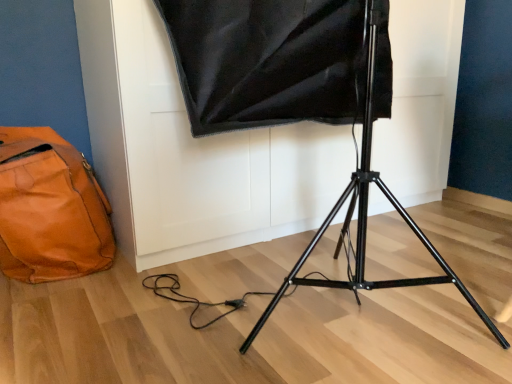
Question: In the image, is orange leather bag at lower left on the left side or the right side of black matte tripod at center?

Choices:
 (A) left
 (B) right

Answer: (A)

Question: Considering the positions of point (84, 218) and point (379, 16), is point (84, 218) closer or farther from the camera than point (379, 16)?

Choices:
 (A) farther
 (B) closer

Answer: (A)

Question: From a real-world perspective, is orange leather bag at lower left positioned above or below black matte tripod at center?

Choices:
 (A) above
 (B) below

Answer: (B)

Question: Considering the positions of black matte tripod at center and orange leather bag at lower left in the image, is black matte tripod at center bigger or smaller than orange leather bag at lower left?

Choices:
 (A) small
 (B) big

Answer: (B)

Question: Does point (368, 107) appear closer or farther from the camera than point (13, 258)?

Choices:
 (A) closer
 (B) farther

Answer: (A)

Question: From their relative heights in the image, would you say black matte tripod at center is taller or shorter than orange leather bag at lower left?

Choices:
 (A) tall
 (B) short

Answer: (A)

Question: In terms of width, does black matte tripod at center look wider or thinner when compared to orange leather bag at lower left?

Choices:
 (A) wide
 (B) thin

Answer: (A)